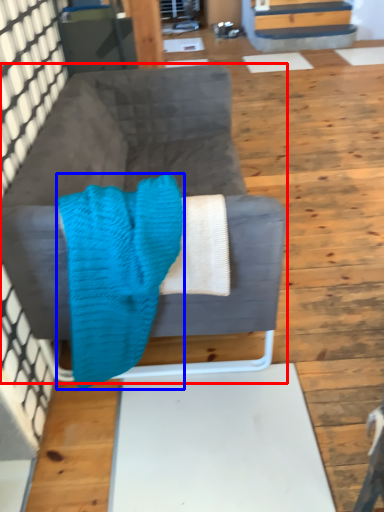
Question: Which of the following is the closest to the observer, studio couch (highlighted by a red box) or blanket (highlighted by a blue box)?

Choices:
 (A) studio couch
 (B) blanket

Answer: (B)